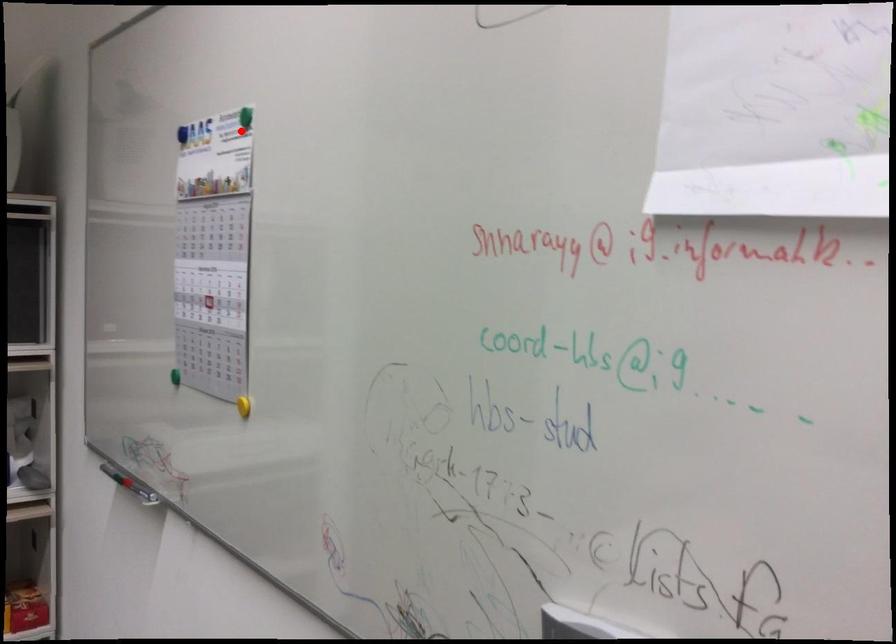
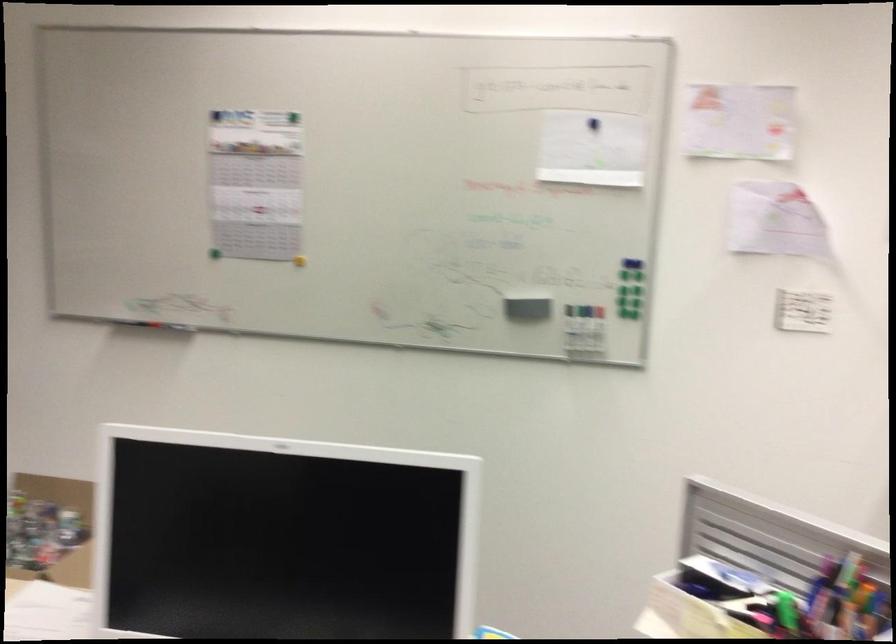
Question: I am providing you with two images of the same scene from different viewpoints. Image1 has a red point marked. In image2, the corresponding 3D location appears at what relative position? Reply with the corresponding letter.

Choices:
 (A) Closer
 (B) Farther

Answer: (B)